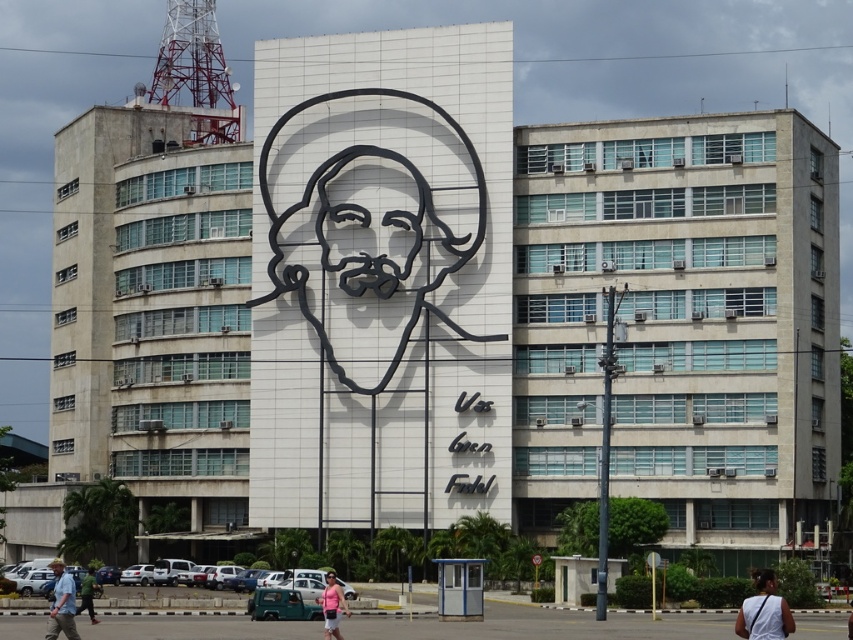
Question: Is black matte face at center behind matte black face at center?

Choices:
 (A) no
 (B) yes

Answer: (B)

Question: Which object is farther from the camera taking this photo?

Choices:
 (A) black matte face at center
 (B) black wireframe face at center
 (C) black outline portrait at center
 (D) green fabric shirt at lower left

Answer: (B)

Question: Is pink fabric at center thinner than black matte face at center?

Choices:
 (A) yes
 (B) no

Answer: (A)

Question: Does black wireframe face at center appear under matte black face at center?

Choices:
 (A) no
 (B) yes

Answer: (A)

Question: Among these objects, which one is farthest from the camera?

Choices:
 (A) black outline portrait at center
 (B) matte black face at center

Answer: (A)

Question: Estimate the real-world distances between objects in this image. Which object is farther from the white fabric bag at lower right?

Choices:
 (A) green fabric shirt at lower left
 (B) black matte face at center
 (C) black outline portrait at center

Answer: (B)